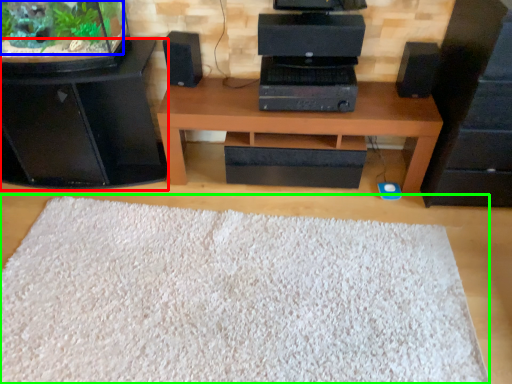
Question: Which object is the closest to the furniture (highlighted by a red box)? Choose among these: plant (highlighted by a blue box) or mat (highlighted by a green box).

Choices:
 (A) plant
 (B) mat

Answer: (A)